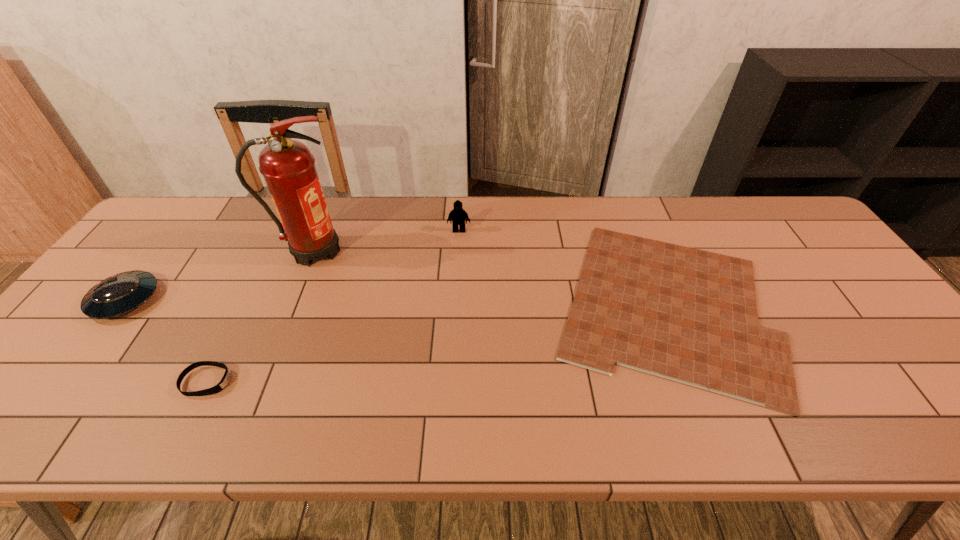
You are a GUI agent. You are given a task and a screenshot of the screen. Output one action in this format:
    pyautogui.click(x=<x>, y=<y>)
    Task: Click on the vacant space at the left edge of the desktop
    
    Given the screenshot: What is the action you would take?
    pyautogui.click(x=68, y=344)

The image size is (960, 540). In order to click on free space at the right edge in this screenshot , I will do `click(852, 328)`.

What are the coordinates of `free region at the far left corner of the desktop` in the screenshot? It's located at (186, 224).

In order to click on free space at the far right corner of the desktop in this screenshot , I will do `click(762, 217)`.

Locate an element on the screen. This screenshot has width=960, height=540. vacant space in between the third tallest object and the second shortest object is located at coordinates (166, 341).

The width and height of the screenshot is (960, 540). Find the location of `unoccupied area between the rightmost object and the Lego`. unoccupied area between the rightmost object and the Lego is located at coordinates (561, 268).

The width and height of the screenshot is (960, 540). I want to click on unoccupied position between the fourth tallest object and the rightmost object, so click(435, 343).

Identify the location of free space between the leftmost object and the fire extinguisher. (219, 275).

Where is `vacant point located between the fourth object from left to right and the tallest object`? vacant point located between the fourth object from left to right and the tallest object is located at coordinates (386, 240).

The width and height of the screenshot is (960, 540). What are the coordinates of `unoccupied area between the leftmost object and the second shortest object` in the screenshot? It's located at (166, 341).